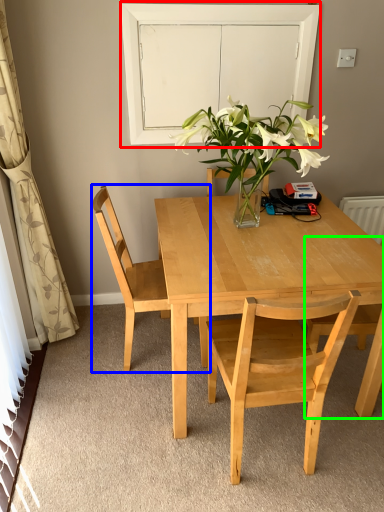
Question: Considering the real-world distances, which object is closest to glass door (highlighted by a red box)? chair (highlighted by a blue box) or chair (highlighted by a green box).

Choices:
 (A) chair
 (B) chair

Answer: (A)